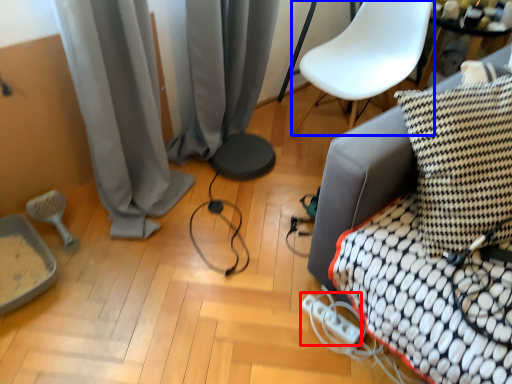
Question: Which of the following is the closest to the observer, extension cord (highlighted by a red box) or armchair (highlighted by a blue box)?

Choices:
 (A) extension cord
 (B) armchair

Answer: (A)